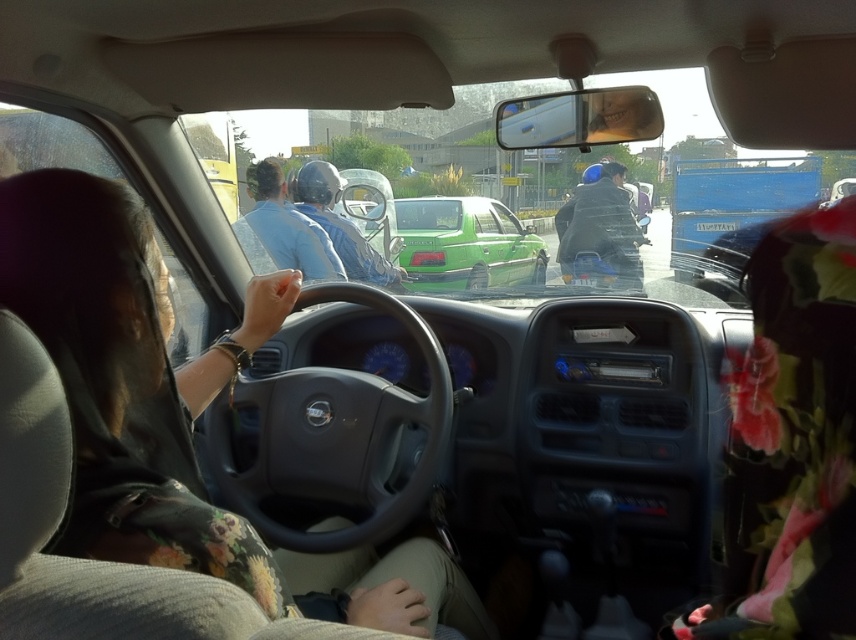
Which of these two, dark blue helmet at center or blue glossy helmet at center, stands taller?

dark blue helmet at center is taller.

Consider the image. Does dark blue helmet at center have a smaller size compared to blue glossy helmet at center?

No, dark blue helmet at center is not smaller than blue glossy helmet at center.

The width and height of the screenshot is (856, 640). What do you see at coordinates (599, 234) in the screenshot?
I see `dark blue helmet at center` at bounding box center [599, 234].

This screenshot has width=856, height=640. Find the location of `dark blue helmet at center`. dark blue helmet at center is located at coordinates (599, 234).

Which of these two, green matte car at center or blue matte helmet at center, stands shorter?

Standing shorter between the two is blue matte helmet at center.

Is green matte car at center closer to the viewer compared to blue matte helmet at center?

That is False.

Locate an element on the screen. The width and height of the screenshot is (856, 640). green matte car at center is located at coordinates (465, 244).

Where is `floral fabric dress at center`? This screenshot has height=640, width=856. floral fabric dress at center is located at coordinates (177, 416).

Is floral fabric dress at center behind blue glossy helmet at center?

No.

Image resolution: width=856 pixels, height=640 pixels. In order to click on floral fabric dress at center in this screenshot , I will do `click(177, 416)`.

The image size is (856, 640). I want to click on floral fabric dress at center, so click(177, 416).